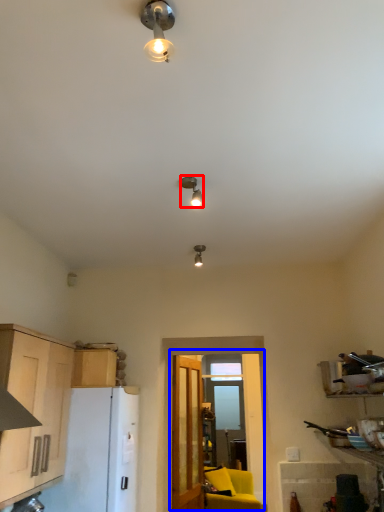
Question: Which object is closer to the camera taking this photo, lamp (highlighted by a red box) or glass door (highlighted by a blue box)?

Choices:
 (A) lamp
 (B) glass door

Answer: (A)